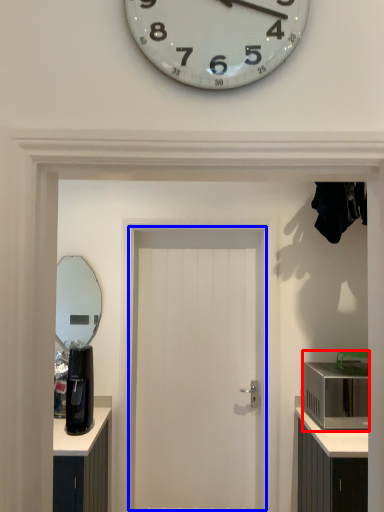
Question: Among these objects, which one is farthest to the camera, appliance (highlighted by a red box) or door (highlighted by a blue box)?

Choices:
 (A) appliance
 (B) door

Answer: (B)